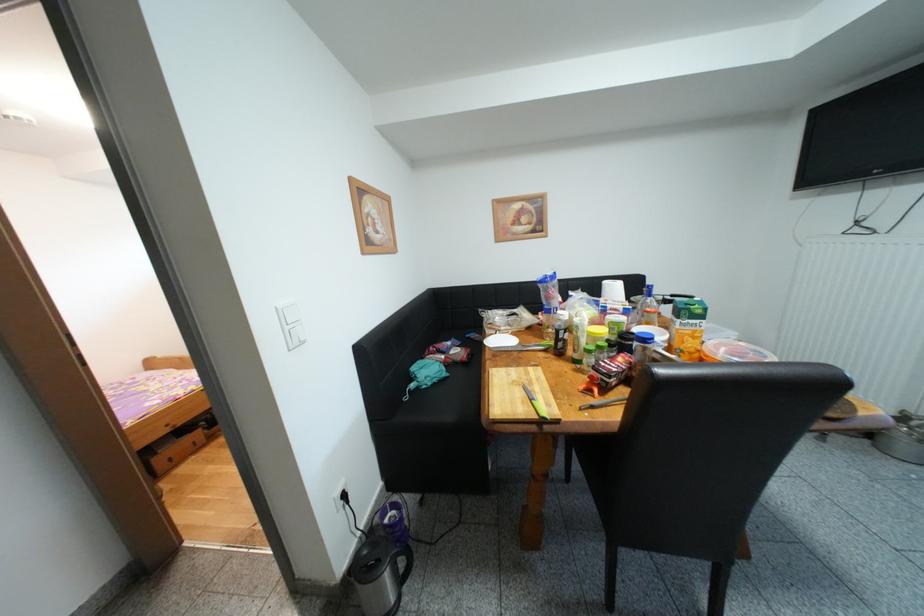
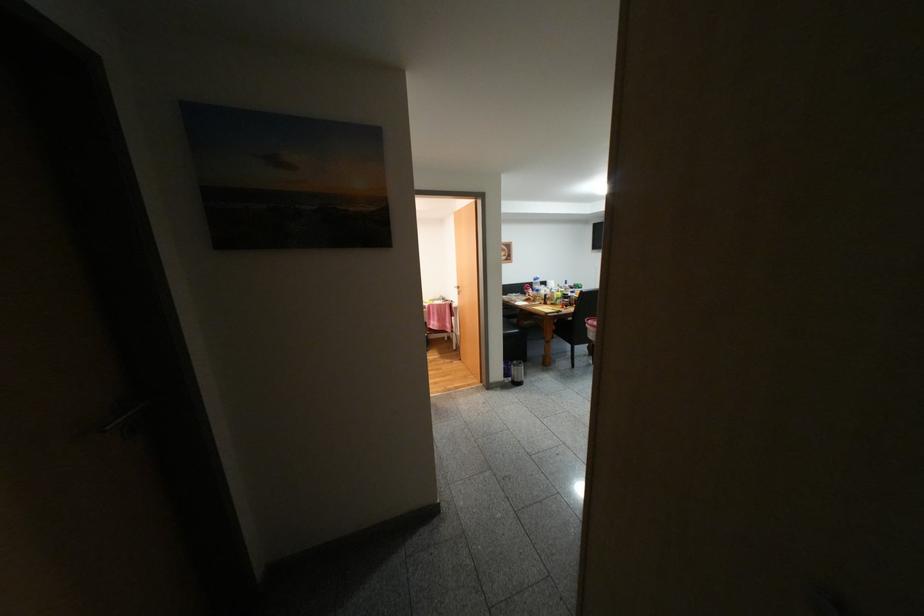
Which direction would the cameraman need to move to produce the second image?

The cameraman walked toward left, backward.